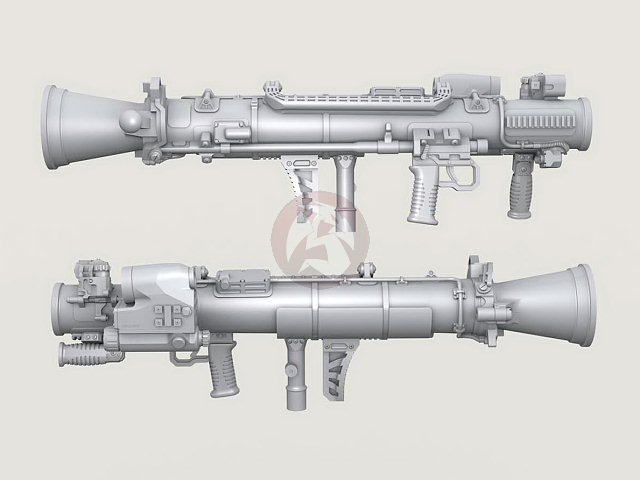
Where is `handle`? Image resolution: width=640 pixels, height=480 pixels. handle is located at coordinates (216, 372), (329, 368), (297, 369), (340, 197), (422, 194), (518, 189).